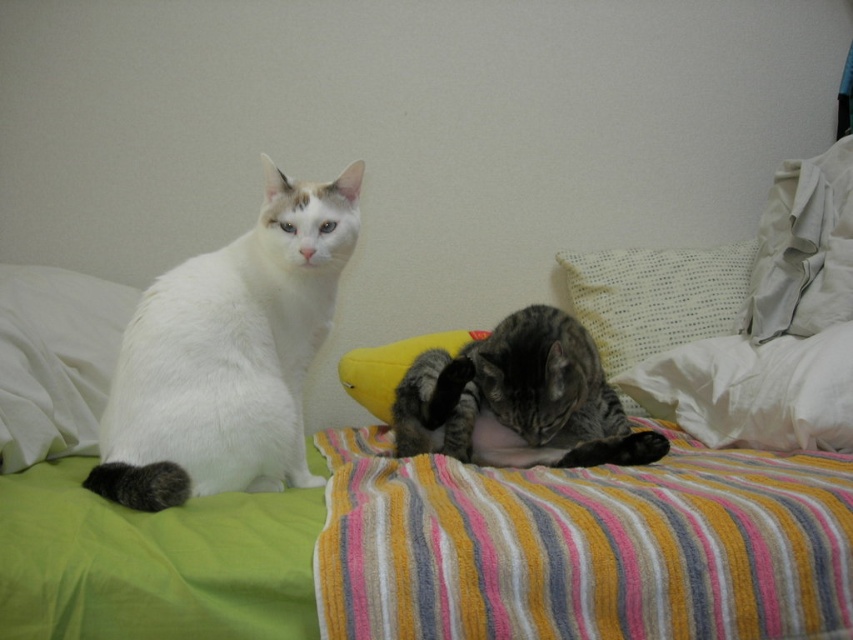
You are standing at the foot of the bed and want to place a small toy between the two points marked as point (405, 444) and point (730, 412). Which point should you place the toy closer to so that it is in front of the other point?

You should place the toy closer to point (405, 444) because it is in front of point (730, 412).

You are standing at the point labeled as point (228, 355) in the image. Which cat is directly in front of you?

The point (228, 355) corresponds to the white fluffy cat at left, so the white fluffy cat at left is directly in front of you.